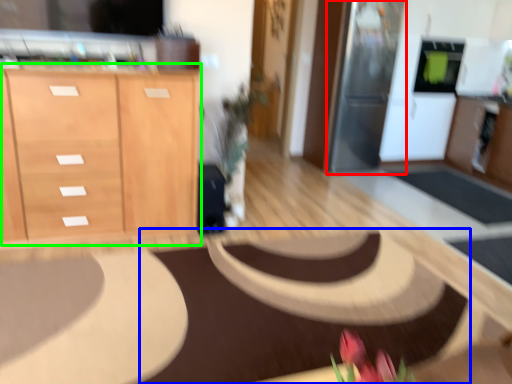
Question: Considering the real-world distances, which object is closest to appliance (highlighted by a red box)? mat (highlighted by a blue box) or cabinetry (highlighted by a green box).

Choices:
 (A) mat
 (B) cabinetry

Answer: (A)